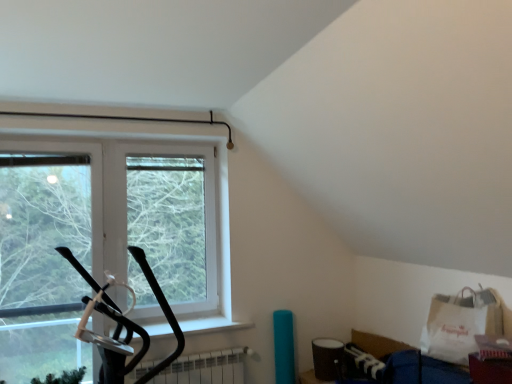
Image resolution: width=512 pixels, height=384 pixels. What do you see at coordinates (460, 324) in the screenshot?
I see `white paper grocery bag at lower right` at bounding box center [460, 324].

Looking at this image, what is the approximate height of white matte radiator at lower center?

It is 32.54 centimeters.

The height and width of the screenshot is (384, 512). Describe the element at coordinates (206, 368) in the screenshot. I see `white matte radiator at lower center` at that location.

Locate an element on the screen. The height and width of the screenshot is (384, 512). clear glass window at center is located at coordinates (170, 221).

Which is closer, (203,380) or (442,341)?

The point (442,341) is more forward.

Between white matte radiator at lower center and white paper grocery bag at lower right, which one has smaller width?

Thinner between the two is white matte radiator at lower center.

Based on their positions, is white matte radiator at lower center located to the left or right of white paper grocery bag at lower right?

Clearly, white matte radiator at lower center is on the left of white paper grocery bag at lower right in the image.

Does white matte radiator at lower center have a lesser height compared to clear glass window at center?

Correct, white matte radiator at lower center is not as tall as clear glass window at center.

From the image's perspective, which is below, white matte radiator at lower center or clear glass window at center?

white matte radiator at lower center appears lower in the image.

Is white matte radiator at lower center positioned beyond the bounds of clear glass window at center?

white matte radiator at lower center is positioned outside clear glass window at center.

In the scene shown: Which of these two, white matte radiator at lower center or clear glass window at center, is wider?

With larger width is white matte radiator at lower center.

Which of these two, clear glass window at center or white matte radiator at lower center, is wider?

With larger width is white matte radiator at lower center.

In the image, there is a clear glass window at center. Identify the location of radiator below it (from the image's perspective). (206, 368).

Is white matte radiator at lower center at the back of clear glass window at center?

No.

Which object is thinner, white paper grocery bag at lower right or white matte radiator at lower center?

Thinner between the two is white matte radiator at lower center.

Considering the positions of points (435, 296) and (173, 380), is point (435, 296) closer to camera compared to point (173, 380)?

Yes.

Is white paper grocery bag at lower right aimed at white matte radiator at lower center?

No.

From the image's perspective, between white paper grocery bag at lower right and white matte radiator at lower center, which one is located above?

white paper grocery bag at lower right appears higher in the image.

Could you tell me if clear glass window at center is facing white paper grocery bag at lower right?

No, clear glass window at center does not turn towards white paper grocery bag at lower right.

Measure the distance between clear glass window at center and white paper grocery bag at lower right.

clear glass window at center and white paper grocery bag at lower right are 1.95 meters apart.

Looking at this image, who is more distant, clear glass window at center or white paper grocery bag at lower right?

clear glass window at center is more distant.

What's the angular difference between clear glass window at center and white paper grocery bag at lower right's facing directions?

The facing directions of clear glass window at center and white paper grocery bag at lower right are 71.1 degrees apart.

Is white paper grocery bag at lower right bigger or smaller than clear glass window at center?

Considering their sizes, white paper grocery bag at lower right takes up less space than clear glass window at center.

Considering the relative positions of white paper grocery bag at lower right and clear glass window at center in the image provided, is white paper grocery bag at lower right in front of clear glass window at center?

That is True.

From the image's perspective, would you say white paper grocery bag at lower right is shown under clear glass window at center?

Yes.

Can you confirm if white paper grocery bag at lower right is positioned to the right of clear glass window at center?

Yes.

The image size is (512, 384). In order to click on radiator that is below the white paper grocery bag at lower right (from the image's perspective) in this screenshot , I will do (206, 368).

Locate an element on the screen. window screen that is on the left side of white matte radiator at lower center is located at coordinates tap(170, 221).

Estimate the real-world distances between objects in this image. Which object is further from white paper grocery bag at lower right, clear glass window at center or white matte radiator at lower center?

Among the two, clear glass window at center is located further to white paper grocery bag at lower right.

Based on their spatial positions, is white paper grocery bag at lower right or white matte radiator at lower center closer to clear glass window at center?

white matte radiator at lower center.

From the picture: Based on their spatial positions, is white matte radiator at lower center or clear glass window at center closer to white paper grocery bag at lower right?

The object closer to white paper grocery bag at lower right is white matte radiator at lower center.

From the image, which object appears to be farther from clear glass window at center, white matte radiator at lower center or white paper grocery bag at lower right?

Among the two, white paper grocery bag at lower right is located further to clear glass window at center.

Considering their positions, is white paper grocery bag at lower right positioned closer to white matte radiator at lower center than clear glass window at center?

The object closer to white matte radiator at lower center is clear glass window at center.

Looking at the image, which one is located closer to white matte radiator at lower center, clear glass window at center or white paper grocery bag at lower right?

Among the two, clear glass window at center is located nearer to white matte radiator at lower center.

The image size is (512, 384). I want to click on radiator between clear glass window at center and white paper grocery bag at lower right from left to right, so click(206, 368).